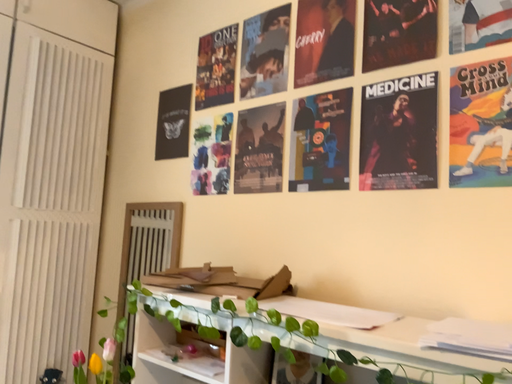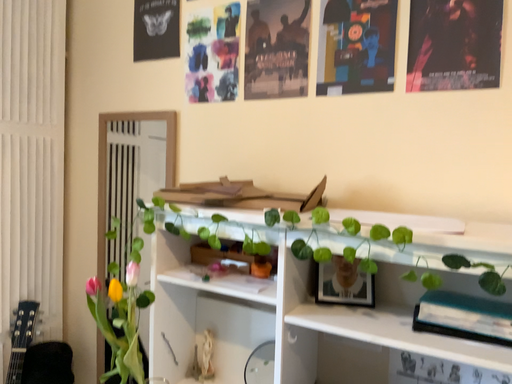
Question: How did the camera likely rotate when shooting the video?

Choices:
 (A) rotated left
 (B) rotated right

Answer: (B)